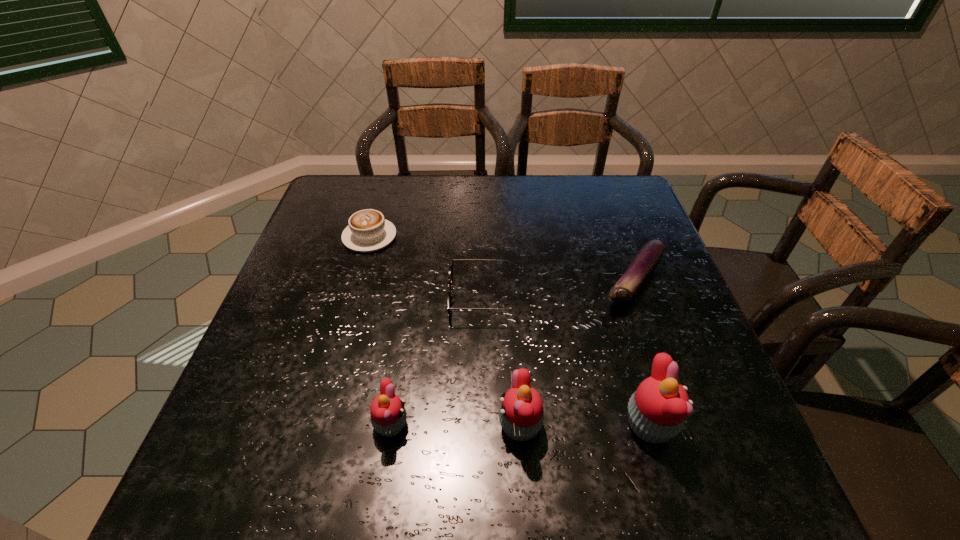
Find the location of a particular element. The width and height of the screenshot is (960, 540). free point that keeps the cupcakes evenly spaced on the left is located at coordinates (262, 425).